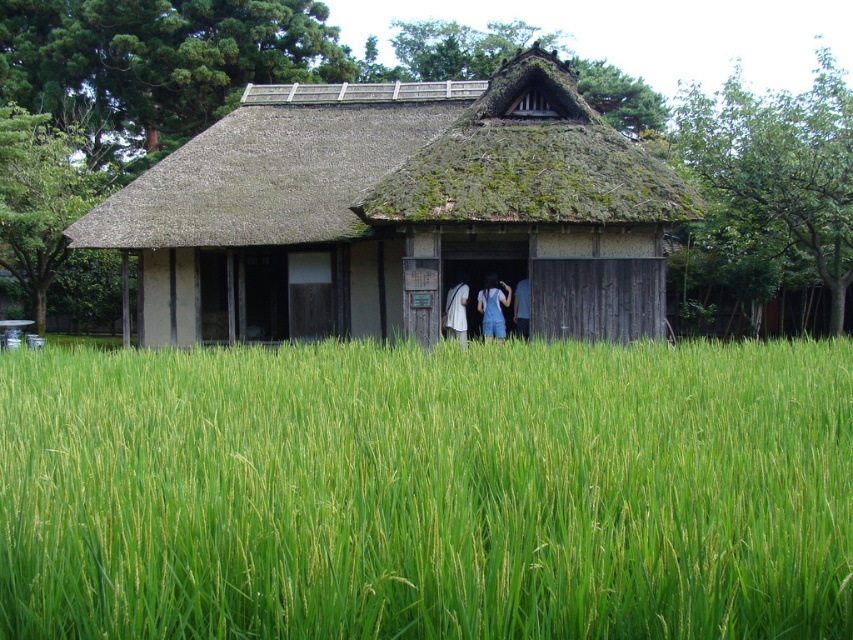
Question: Can you confirm if thatched wood hut at center is positioned below denim shorts at center?

Choices:
 (A) no
 (B) yes

Answer: (A)

Question: Does thatched wood hut at center have a lesser width compared to green mossy thatch at center?

Choices:
 (A) no
 (B) yes

Answer: (A)

Question: Considering the relative positions of white fabric at center and denim pants at center in the image provided, where is white fabric at center located with respect to denim pants at center?

Choices:
 (A) above
 (B) below

Answer: (B)

Question: Among these objects, which one is nearest to the camera?

Choices:
 (A) denim overalls at center
 (B) green grassy rice field at center
 (C) white fabric at center
 (D) denim shorts at center

Answer: (B)

Question: Among these points, which one is farthest from the camera?

Choices:
 (A) (450, 294)
 (B) (486, 296)
 (C) (489, 323)

Answer: (A)

Question: Which of the following is the farthest from the observer?

Choices:
 (A) (460, 291)
 (B) (657, 204)
 (C) (764, 628)

Answer: (A)